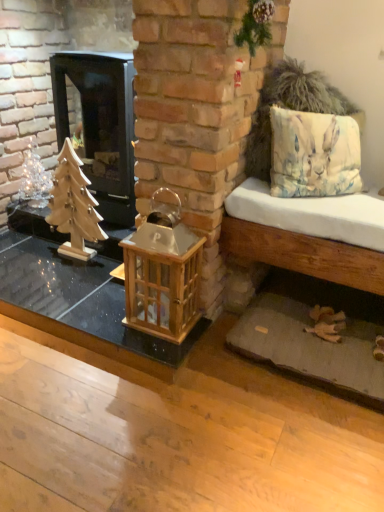
The height and width of the screenshot is (512, 384). What are the coordinates of `empty space that is ontop of wooden table at center (from a real-world perspective)` in the screenshot? It's located at (64, 276).